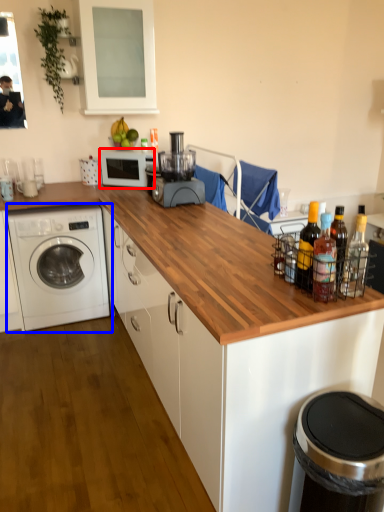
Question: Which of the following is the farthest to the observer, home appliance (highlighted by a red box) or washing machine (highlighted by a blue box)?

Choices:
 (A) home appliance
 (B) washing machine

Answer: (A)